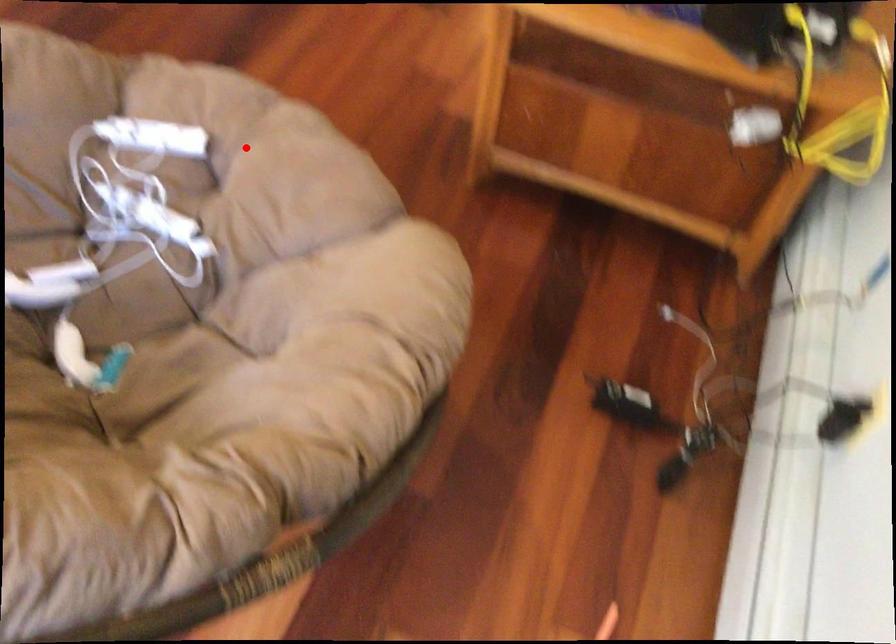
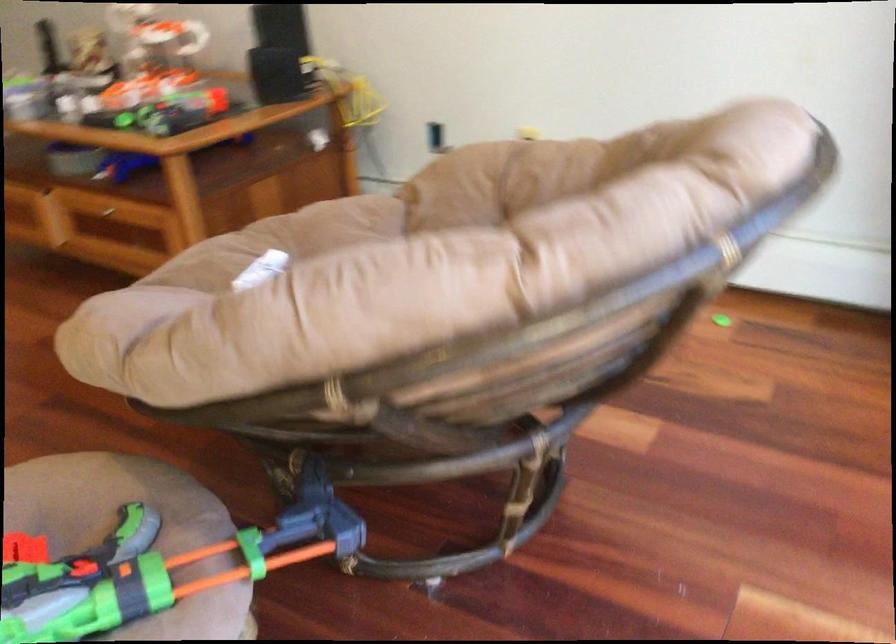
Question: A red point is marked in image1. In image2, is the corresponding 3D point closer to the camera or farther? Reply with the corresponding letter.

Choices:
 (A) The corresponding 3D point is closer.
 (B) The corresponding 3D point is farther.

Answer: (B)